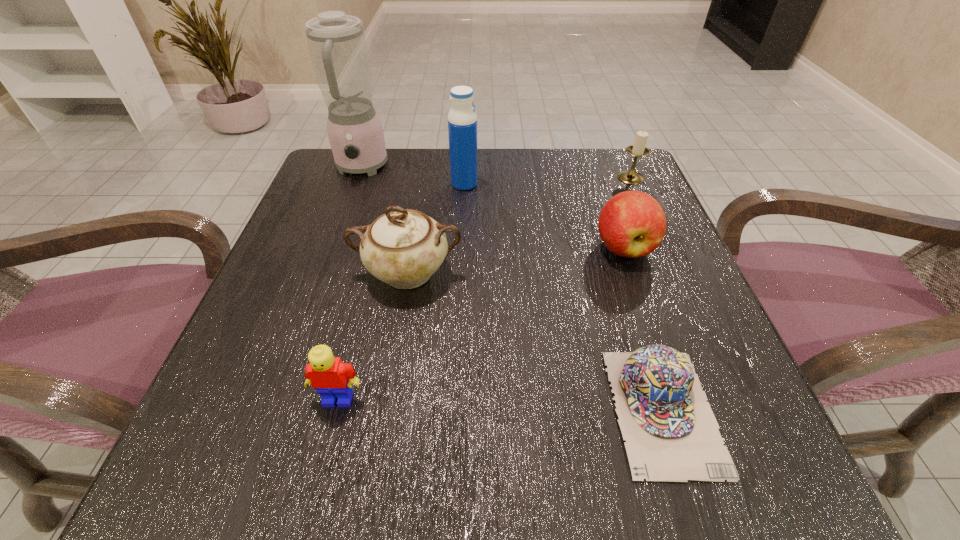
Where is `free space at the far right corner of the desktop`? This screenshot has height=540, width=960. free space at the far right corner of the desktop is located at coordinates (627, 158).

This screenshot has height=540, width=960. Find the location of `free point between the food processor and the shortest object`. free point between the food processor and the shortest object is located at coordinates (512, 289).

Where is `free spot between the cap and the apple`? free spot between the cap and the apple is located at coordinates (643, 329).

At what (x,y) coordinates should I click in order to perform the action: click on free point between the tallest object and the Lego. Please return your answer as a coordinate pair (x, y). Looking at the image, I should click on (349, 284).

I want to click on unoccupied position between the candle holder and the food processor, so click(496, 173).

Image resolution: width=960 pixels, height=540 pixels. What are the coordinates of `free space between the water bottle and the Lego` in the screenshot? It's located at click(401, 291).

The height and width of the screenshot is (540, 960). Identify the location of free space between the shortest object and the tallest object. (512, 289).

Find the location of a particular element. This screenshot has height=540, width=960. unoccupied position between the sixth shortest object and the Lego is located at coordinates (401, 291).

The height and width of the screenshot is (540, 960). I want to click on free area in between the third tallest object and the Lego, so (x=373, y=336).

Find the location of a particular element. free space between the sixth shortest object and the tallest object is located at coordinates (413, 176).